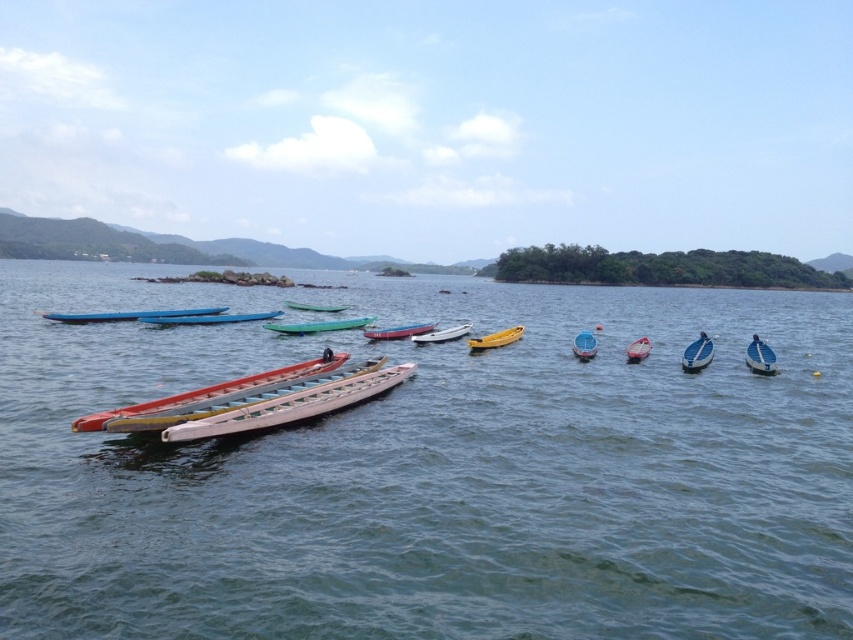
Question: Can you confirm if metallic blue kayak at center is positioned to the left of green plastic boat at center?

Choices:
 (A) no
 (B) yes

Answer: (A)

Question: Based on their relative distances, which object is nearer to the white glossy boat at center?

Choices:
 (A) green plastic canoe at center
 (B) wooden canoe at center

Answer: (A)

Question: Does matte blue canoe at left appear under metallic silver canoe at center?

Choices:
 (A) no
 (B) yes

Answer: (A)

Question: Can you confirm if wooden canoe at center is positioned to the right of white glossy canoe at center?

Choices:
 (A) yes
 (B) no

Answer: (B)

Question: Among these points, which one is farthest from the camera?

Choices:
 (A) (421, 330)
 (B) (281, 326)
 (C) (73, 314)

Answer: (A)

Question: Which of the following is the farthest from the observer?

Choices:
 (A) (300, 308)
 (B) (582, 348)
 (C) (407, 337)
 (D) (326, 548)

Answer: (A)